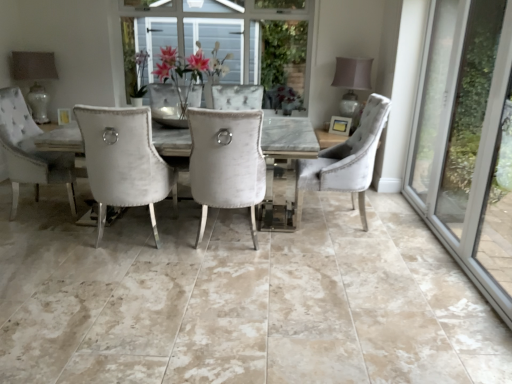
Image resolution: width=512 pixels, height=384 pixels. I want to click on free space that is in between transparent glass door at right and velvet grey chair at right, the second chair in the left-to-right sequence, so click(x=391, y=241).